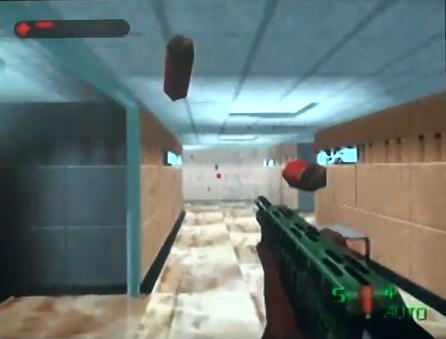
This screenshot has height=339, width=446. In order to click on floor in this screenshot , I will do `click(201, 301)`.